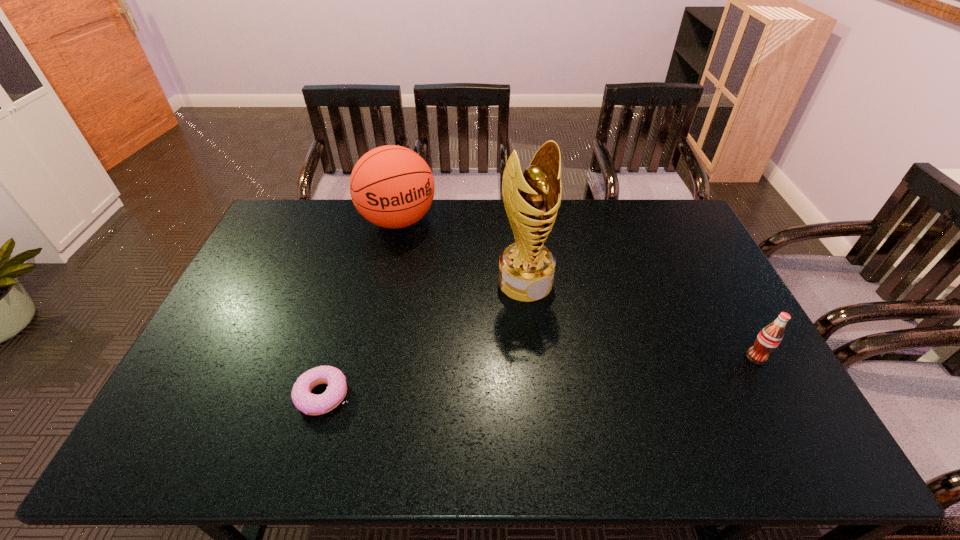
Find the location of `vacant space located 0.350m on the front-facing side of the third object from left to right`. vacant space located 0.350m on the front-facing side of the third object from left to right is located at coordinates (609, 392).

What are the coordinates of `free space located 0.200m on the front-facing side of the third object from left to right` in the screenshot? It's located at (576, 349).

At what (x,y) coordinates should I click in order to perform the action: click on vacant space located on the front-facing side of the third object from left to right. Please return your answer as a coordinate pair (x, y). Image resolution: width=960 pixels, height=540 pixels. Looking at the image, I should click on (597, 377).

Find the location of a particular element. The image size is (960, 540). free spot located on the side with logo of the farthest object is located at coordinates (425, 267).

Locate an element on the screen. This screenshot has height=540, width=960. vacant space situated 0.050m on the side with logo of the farthest object is located at coordinates (416, 252).

Locate an element on the screen. Image resolution: width=960 pixels, height=540 pixels. vacant space located 0.120m on the side with logo of the farthest object is located at coordinates (423, 264).

Find the location of a particular element. This screenshot has width=960, height=540. object located in the far edge section of the desktop is located at coordinates (391, 186).

In order to click on object located at the near edge in this screenshot , I will do `click(311, 404)`.

Identify the location of object that is positioned at the right edge. The height and width of the screenshot is (540, 960). click(x=769, y=338).

You are a GUI agent. You are given a task and a screenshot of the screen. Output one action in this format:
    pyautogui.click(x=<x>, y=<y>)
    Task: Click on the vacant space at the far edge
    The width and height of the screenshot is (960, 540).
    Given the screenshot: What is the action you would take?
    pyautogui.click(x=629, y=227)